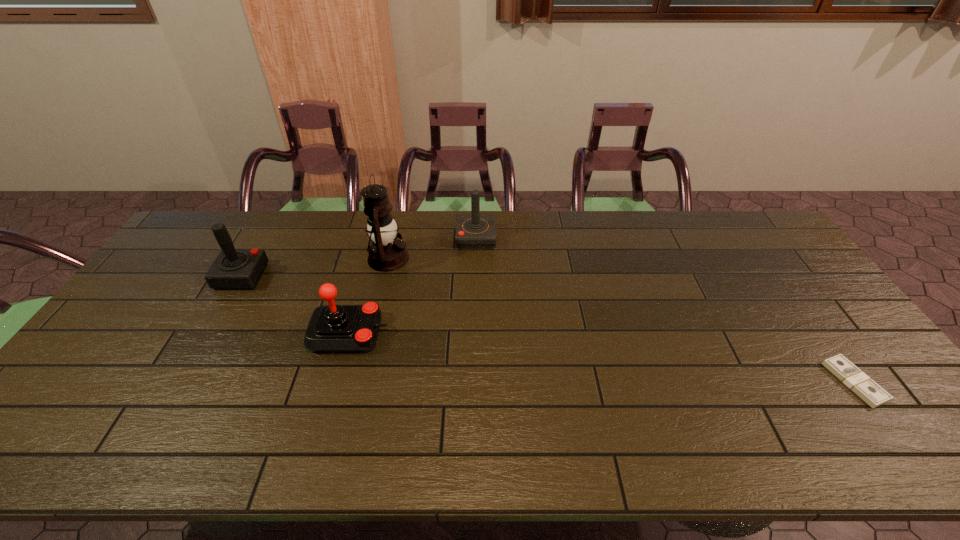
Identify the location of free area in between the second nearest object and the shortest object. This screenshot has width=960, height=540. (602, 357).

Select which object appears as the fourth closest to the tallest object. Please provide its 2D coordinates. Your answer should be formatted as a tuple, i.e. [(x, y)], where the tuple contains the x and y coordinates of a point satisfying the conditions above.

[(868, 390)]

In order to click on object that is the fourth closest to the lantern in this screenshot , I will do `click(868, 390)`.

Point out which joystick is positioned as the nearest to the farthest joystick. Please provide its 2D coordinates. Your answer should be formatted as a tuple, i.e. [(x, y)], where the tuple contains the x and y coordinates of a point satisfying the conditions above.

[(332, 328)]

Locate which joystick is the third closest to the shortest object. Please provide its 2D coordinates. Your answer should be formatted as a tuple, i.e. [(x, y)], where the tuple contains the x and y coordinates of a point satisfying the conditions above.

[(234, 268)]

The height and width of the screenshot is (540, 960). Identify the location of vacant space that satisfies the following two spatial constraints: 1. on the base of the nearest object; 2. on the right side of the second nearest object. (336, 382).

Image resolution: width=960 pixels, height=540 pixels. I want to click on free location that satisfies the following two spatial constraints: 1. on the side of the nearest object, there is a wick adjustment knob; 2. on the left side of the lantern, so click(360, 382).

Image resolution: width=960 pixels, height=540 pixels. What are the coordinates of `free space that satisfies the following two spatial constraints: 1. on the back side of the nearest object; 2. on the rectangular base of the farthest joystick` in the screenshot? It's located at (750, 238).

This screenshot has width=960, height=540. In order to click on free space that satisfies the following two spatial constraints: 1. on the side of the lantern, there is a wick adjustment knob; 2. on the back side of the dollar in this screenshot , I will do `click(360, 382)`.

The image size is (960, 540). Identify the location of free space that satisfies the following two spatial constraints: 1. on the side of the tallest object, there is a wick adjustment knob; 2. on the back side of the nearest object. (360, 382).